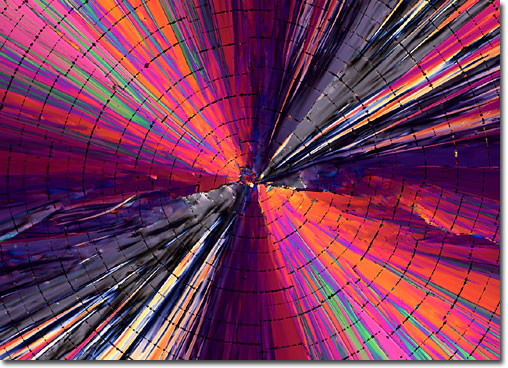
Image resolution: width=508 pixels, height=368 pixels. What are the coordinates of `white light` in the screenshot? It's located at (284, 147).